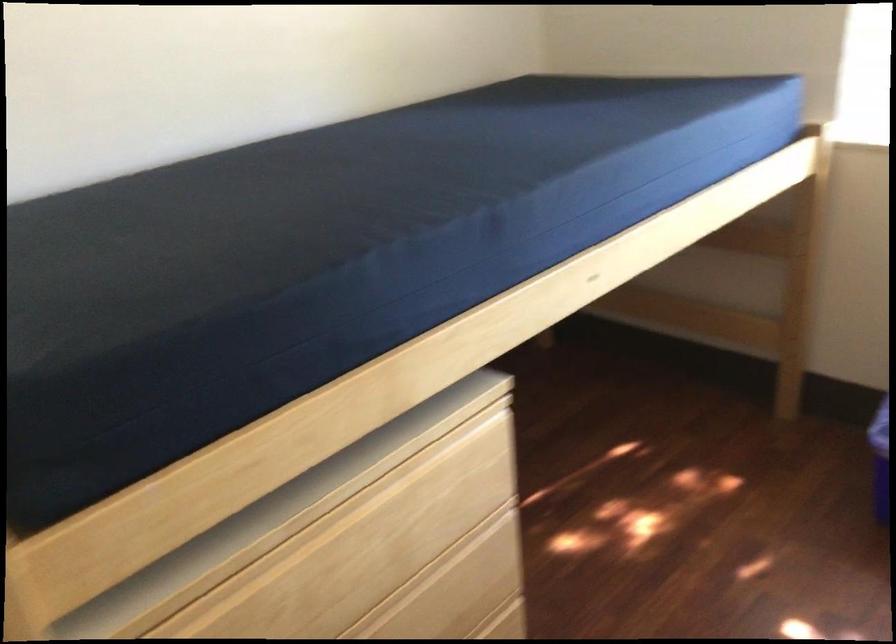
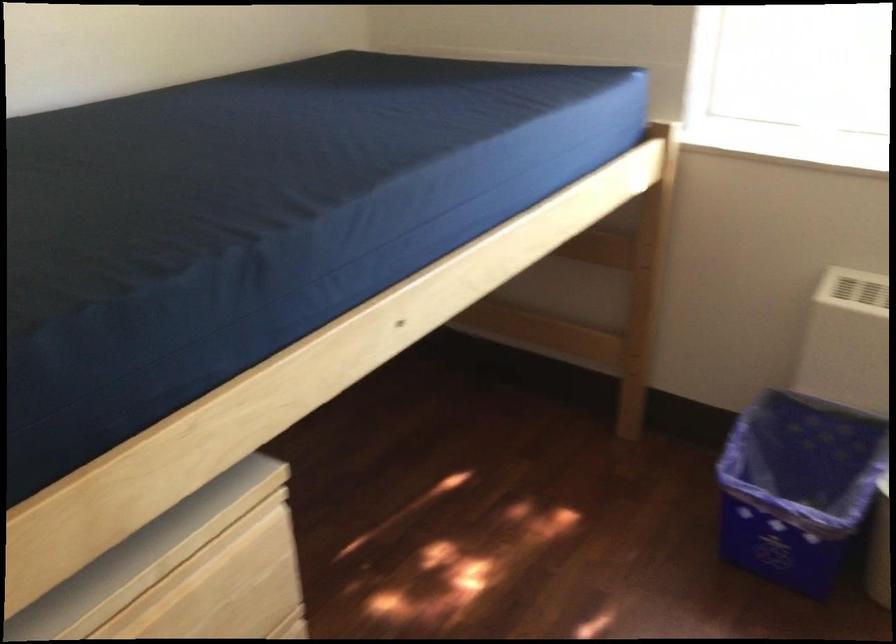
Question: The first image is from the beginning of the video and the second image is from the end. How did the camera likely rotate when shooting the video?

Choices:
 (A) Left
 (B) Right
 (C) Up
 (D) Down

Answer: (B)